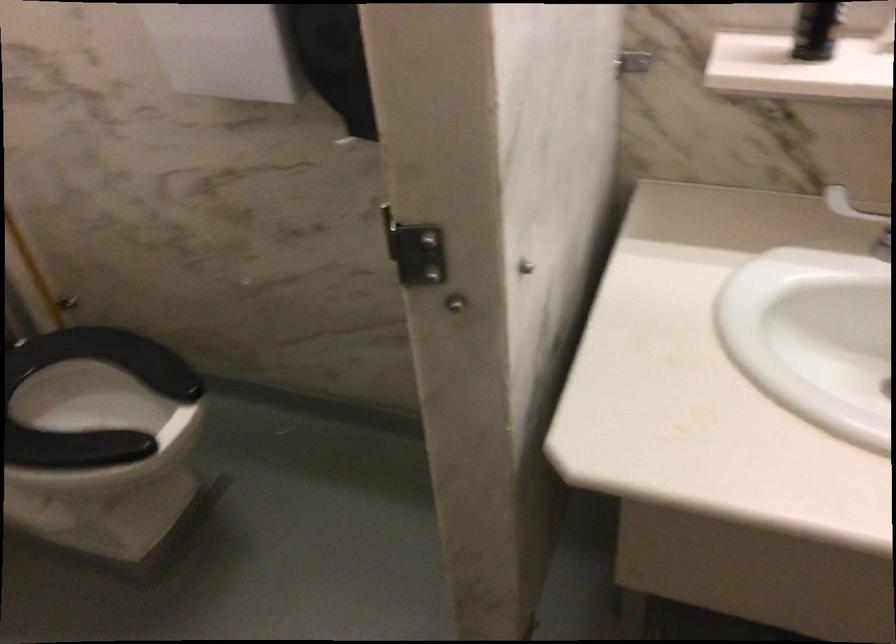
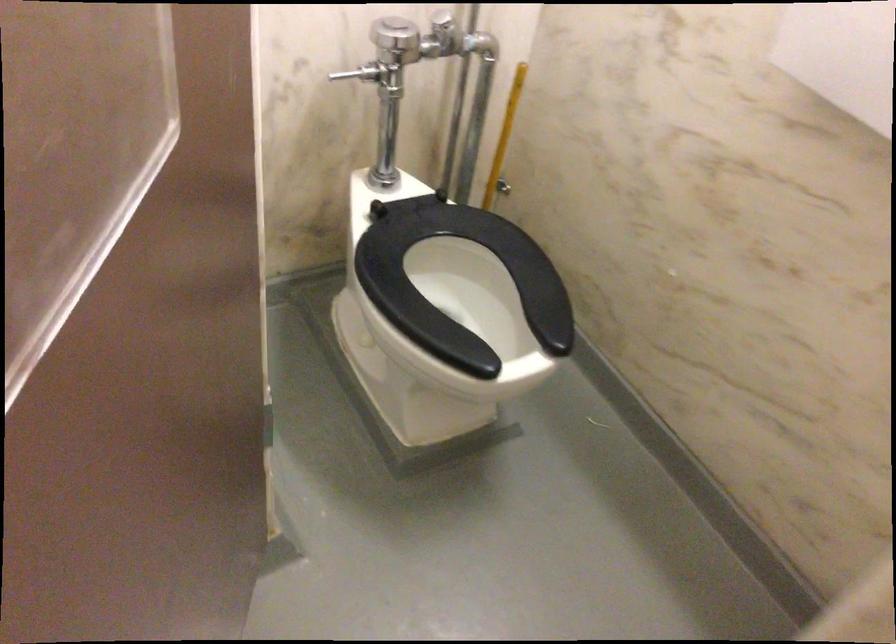
The point at (88, 397) is marked in the first image. Where is the corresponding point in the second image?

(461, 285)